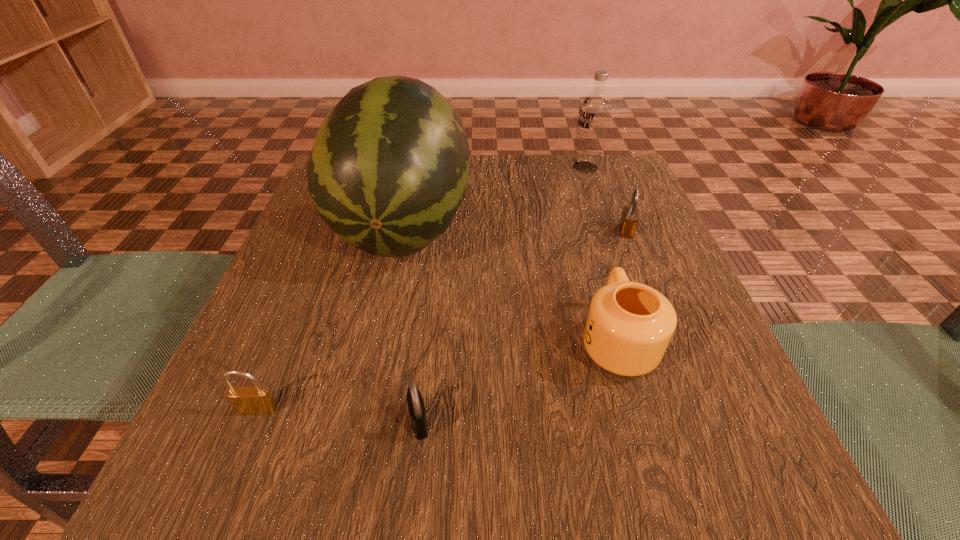
You are a GUI agent. You are given a task and a screenshot of the screen. Output one action in this format:
    pyautogui.click(x=<x>, y=<y>)
    Task: Click on the blank space at the right edge
    
    Given the screenshot: What is the action you would take?
    pyautogui.click(x=678, y=293)

Where is `vacant space at the near left corner of the desktop`? This screenshot has width=960, height=540. vacant space at the near left corner of the desktop is located at coordinates (228, 497).

Image resolution: width=960 pixels, height=540 pixels. I want to click on vacant space that's between the second padlock from left to right and the leftmost padlock, so click(x=339, y=416).

You are a GUI agent. You are given a task and a screenshot of the screen. Output one action in this format:
    pyautogui.click(x=<x>, y=<y>)
    Task: Click on the vacant area between the leftmost padlock and the second padlock from right to left
    This screenshot has height=540, width=960.
    Given the screenshot: What is the action you would take?
    pyautogui.click(x=339, y=416)

The height and width of the screenshot is (540, 960). I want to click on free spot between the farthest object and the farthest padlock, so click(606, 199).

This screenshot has height=540, width=960. I want to click on unoccupied position between the fifth shortest object and the rightmost padlock, so [x=606, y=199].

Locate an element on the screen. The height and width of the screenshot is (540, 960). vacant point located between the second padlock from left to right and the tallest object is located at coordinates 411,323.

Identify the location of empty space that is in between the leftmost padlock and the tallest object. (330, 318).

Image resolution: width=960 pixels, height=540 pixels. Identify the location of free spot between the tallest object and the farthest object. (493, 196).

You are a GUI agent. You are given a task and a screenshot of the screen. Output one action in this format:
    pyautogui.click(x=<x>, y=<y>)
    Task: Click on the vacant area that lies between the second padlock from left to right and the third tallest object
    The image size is (960, 540).
    Given the screenshot: What is the action you would take?
    pyautogui.click(x=517, y=381)